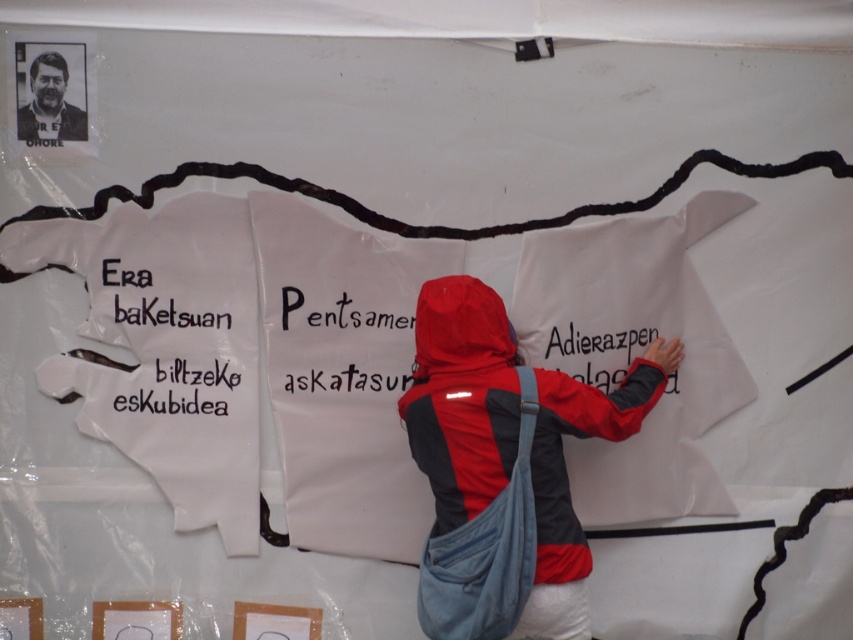
Question: Can you confirm if black paper at left is positioned above matte black jacket at upper left?

Choices:
 (A) yes
 (B) no

Answer: (B)

Question: Which of the following is the farthest from the observer?

Choices:
 (A) black paper at left
 (B) matte black jacket at upper left
 (C) black paper at center

Answer: (A)

Question: In this image, where is black paper at left located relative to matte black jacket at upper left?

Choices:
 (A) right
 (B) left

Answer: (A)

Question: Does red fabric jacket at center have a lesser width compared to black paper at center?

Choices:
 (A) no
 (B) yes

Answer: (A)

Question: Based on their relative distances, which object is nearer to the black paper at left?

Choices:
 (A) matte black jacket at upper left
 (B) red fabric jacket at center
 (C) black paper at center

Answer: (C)

Question: Which object is the closest to the matte black jacket at upper left?

Choices:
 (A) red fabric jacket at center
 (B) black paper at left

Answer: (B)